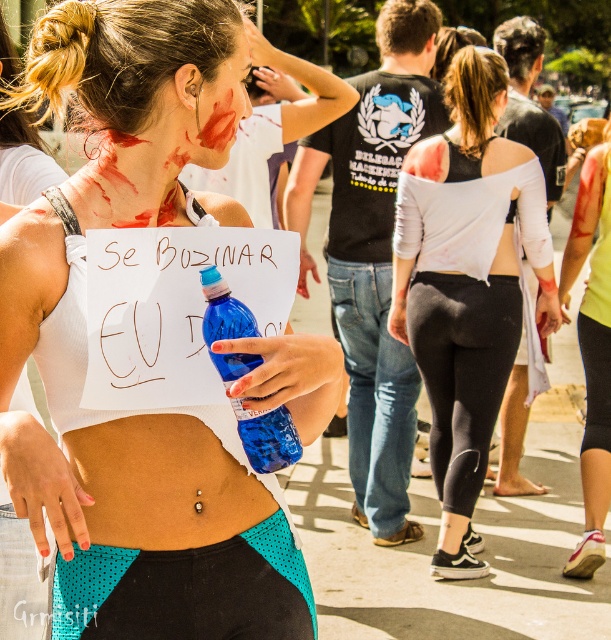
Can you confirm if teal mesh shorts at lower center is positioned below yellow fabric shirt at center?

Correct, teal mesh shorts at lower center is located below yellow fabric shirt at center.

Does teal mesh shorts at lower center come behind yellow fabric shirt at center?

No, it is not.

Is point (178, 596) farther from viewer compared to point (593, 563)?

No, (178, 596) is closer to viewer.

Identify the location of teal mesh shorts at lower center. The width and height of the screenshot is (611, 640). (188, 589).

Is matte white tank top at center to the left of teal mesh shorts at lower center from the viewer's perspective?

Result: Correct, you'll find matte white tank top at center to the left of teal mesh shorts at lower center.

Looking at this image, how distant is matte white tank top at center from teal mesh shorts at lower center?

matte white tank top at center and teal mesh shorts at lower center are 8.36 inches apart.

The image size is (611, 640). What are the coordinates of `matte white tank top at center` in the screenshot? It's located at (86, 348).

You are a GUI agent. You are given a task and a screenshot of the screen. Output one action in this format:
    pyautogui.click(x=<x>, y=<y>)
    Task: Click on the white matte tank top at center
    The width and height of the screenshot is (611, 640).
    Given the screenshot: What is the action you would take?
    pyautogui.click(x=466, y=284)

Does white matte tank top at center have a lesser width compared to yellow fabric shirt at center?

No, white matte tank top at center is not thinner than yellow fabric shirt at center.

You are a GUI agent. You are given a task and a screenshot of the screen. Output one action in this format:
    pyautogui.click(x=<x>, y=<y>)
    Task: Click on the white matte tank top at center
    This screenshot has width=611, height=640.
    Given the screenshot: What is the action you would take?
    pyautogui.click(x=466, y=284)

Find the location of `white matte tank top at center`. white matte tank top at center is located at coordinates (466, 284).